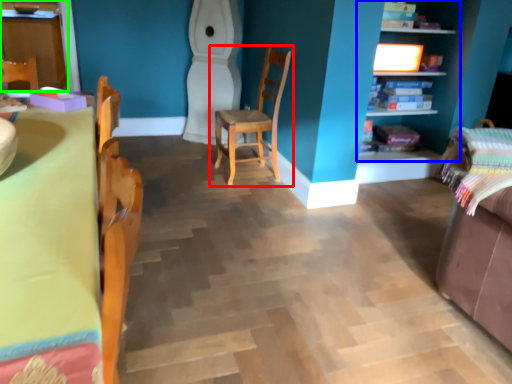
Question: Based on their relative distances, which object is farther from chair (highlighted by a red box)? Choose from shelf (highlighted by a blue box) and cabinetry (highlighted by a green box).

Choices:
 (A) shelf
 (B) cabinetry

Answer: (B)